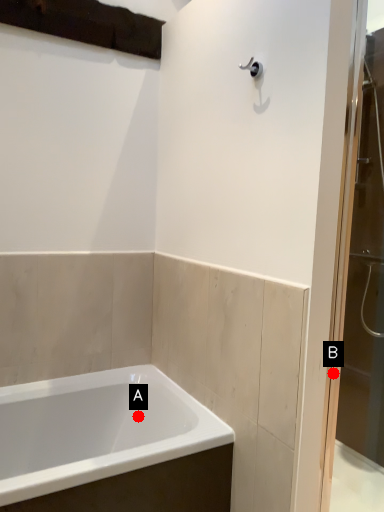
Question: Two points are circled on the image, labeled by A and B beside each circle. Which point is farther to the camera?

Choices:
 (A) A is further
 (B) B is further

Answer: (A)